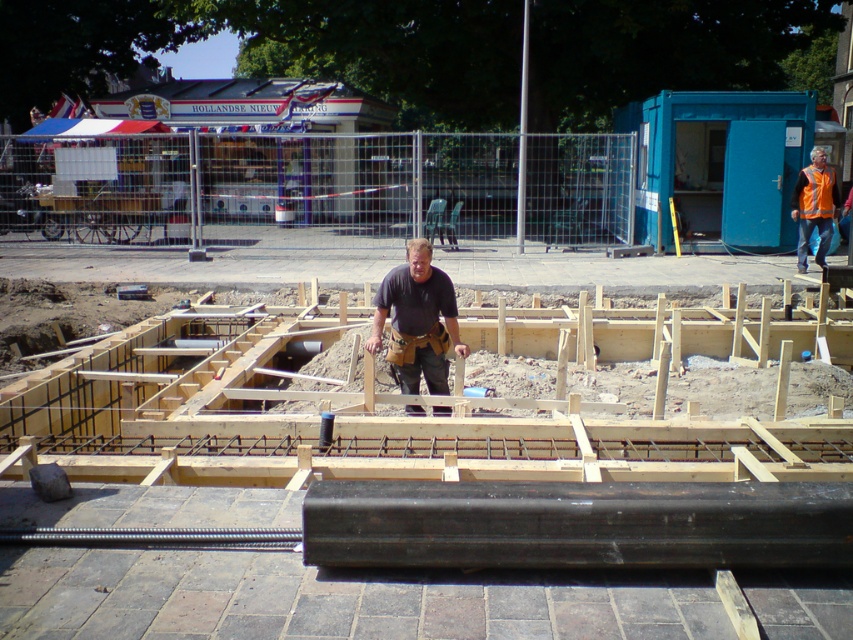
Is brown leather tool belt at center shorter than orange reflective vest at right?

Indeed, brown leather tool belt at center has a lesser height compared to orange reflective vest at right.

Is point (457, 333) more distant than point (801, 260)?

That is False.

Image resolution: width=853 pixels, height=640 pixels. Describe the element at coordinates (416, 321) in the screenshot. I see `brown leather tool belt at center` at that location.

Identify the location of brown leather tool belt at center. point(416,321).